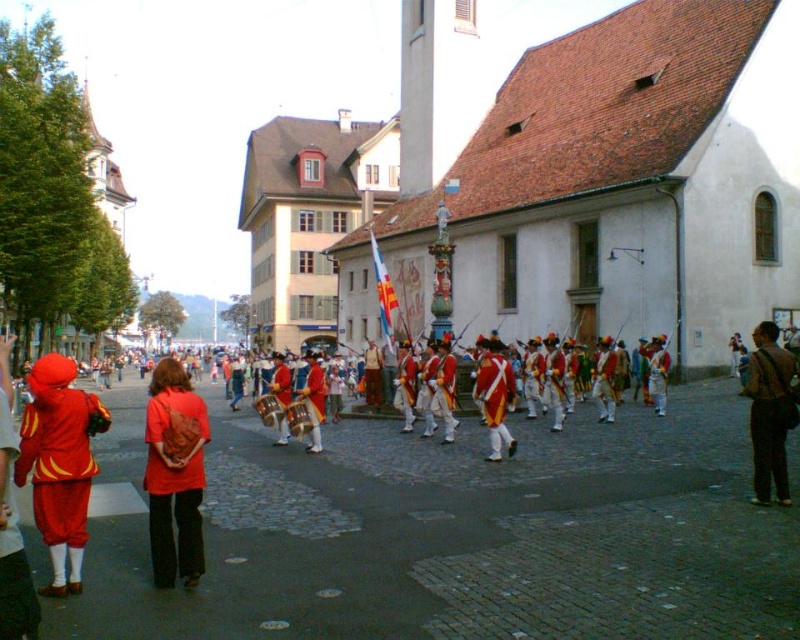
Is matte red costume at left positioned before matte red shirt at center?

Yes.

Between matte red costume at left and matte red shirt at center, which one has more height?

matte red costume at left is taller.

Which is behind, point (54, 582) or point (156, 388)?

The point (156, 388) is behind.

Find the location of `matte red costume at left`. matte red costume at left is located at coordinates (60, 464).

The width and height of the screenshot is (800, 640). I want to click on matte red costume at left, so click(60, 464).

The width and height of the screenshot is (800, 640). I want to click on matte red costume at left, so tap(60, 464).

The width and height of the screenshot is (800, 640). Identify the location of matte red costume at left. tap(60, 464).

Between red uniformed soldiers at center and matte red shirt at center, which one has more height?

matte red shirt at center is taller.

Is red uniformed soldiers at center below matte red shirt at center?

Correct, red uniformed soldiers at center is located below matte red shirt at center.

This screenshot has height=640, width=800. Identify the location of red uniformed soldiers at center. (452, 532).